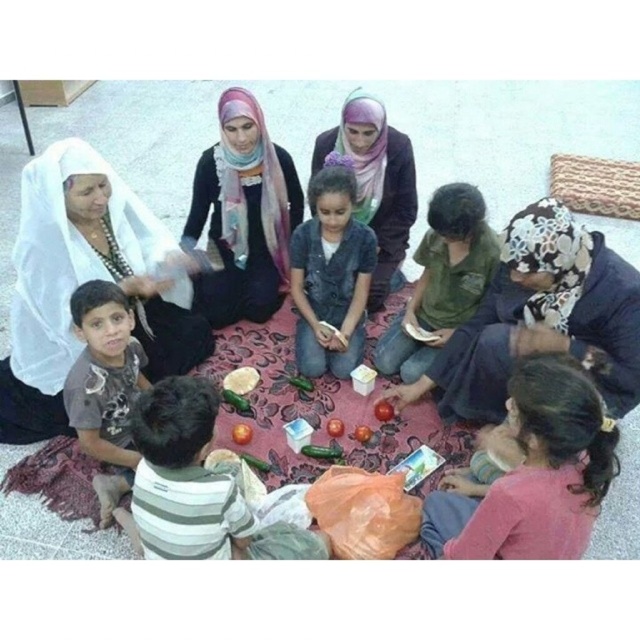
You are organizing a small event and need to place a decorative tomato in the center of the table. However, there is a pink fabric already placed at the lower right corner of the table. According to the image, can the red matte tomato at center be placed in the center of the table without moving the pink fabric at lower right?

The pink fabric at lower right is positioned over the red matte tomato at center, so the red matte tomato at center cannot be placed in the center of the table without moving the pink fabric at lower right.

You are a photographer standing at the camera position. You want to take a closeup shot of the striped cotton shirt at lower left. Can you reach it with your 1.5 meter long extendable pole?

The distance between the striped cotton shirt at lower left and the camera is 1.72 meters, which is longer than the 1.5 meter extendable pole. Therefore, the pole is too short to reach the shirt for a closeup.

You are organizing a small event and need to determine which item is larger for proper arrangement. Given the scene described, which object is larger between the pink fabric at lower right and the red matte tomato at center?

The pink fabric at lower right is bigger than the red matte tomato at center according to the description.